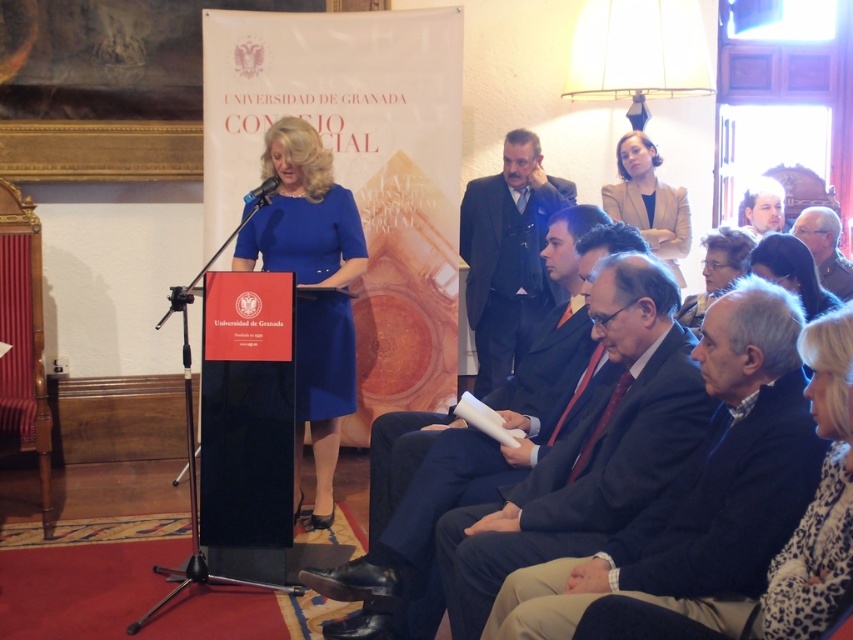
You are standing at the point marked by the coordinates (x=477, y=458) in the image. What object is located at this position?

The point marked by the coordinates (x=477, y=458) indicates the location of the dark suit at center.

From the picture: You are standing in the conference room and see two points marked in the image. Which point, point (x=592, y=362) or point (x=730, y=237), is closer to you?

Point (x=592, y=362) is closer to you than point (x=730, y=237).

You are a photographer at the event and want to capture a photo of the dark suit at center and the matte black hair at upper center. Which one should you focus on first if you want to ensure both are in focus?

The dark suit at center is taller than matte black hair at upper center, so focusing on the dark suit at center first would help ensure both are in focus since it is larger in the frame.